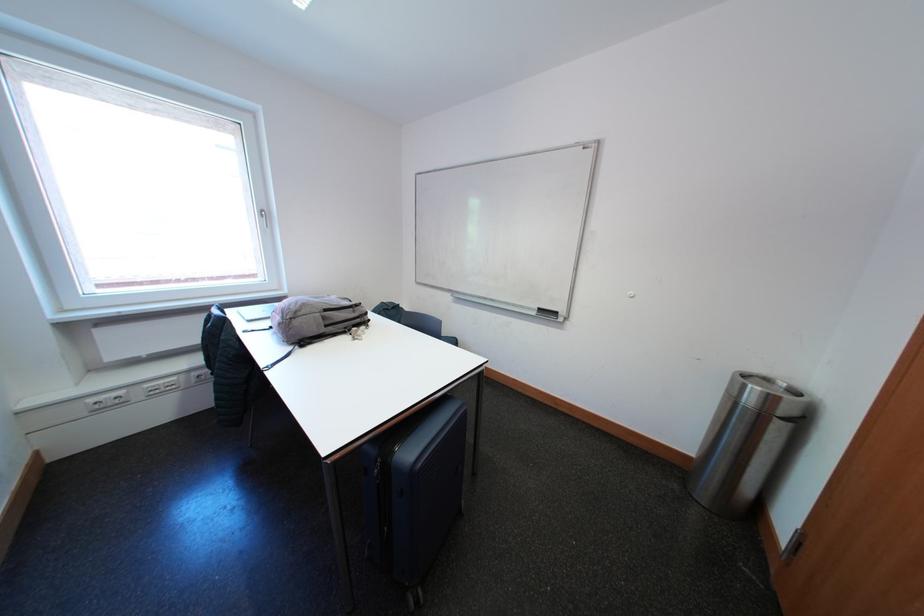
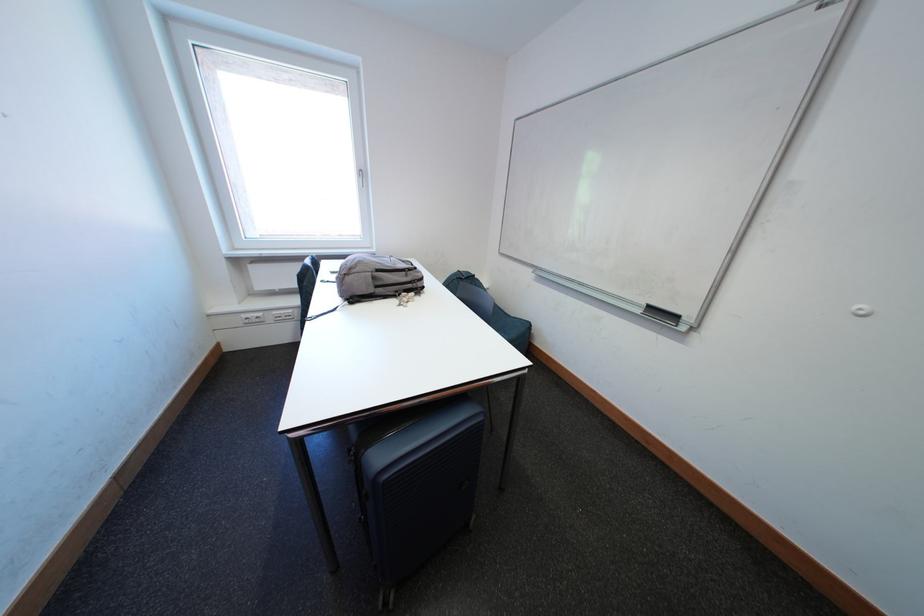
The point at (101,403) is marked in the first image. Where is the corresponding point in the second image?

(253, 320)